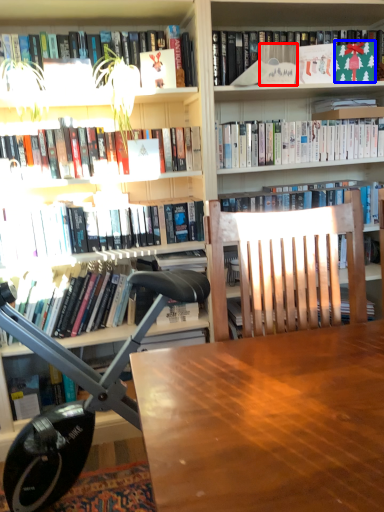
Question: Which point is further to the camera, paperback book (highlighted by a red box) or paperback book (highlighted by a blue box)?

Choices:
 (A) paperback book
 (B) paperback book

Answer: (B)